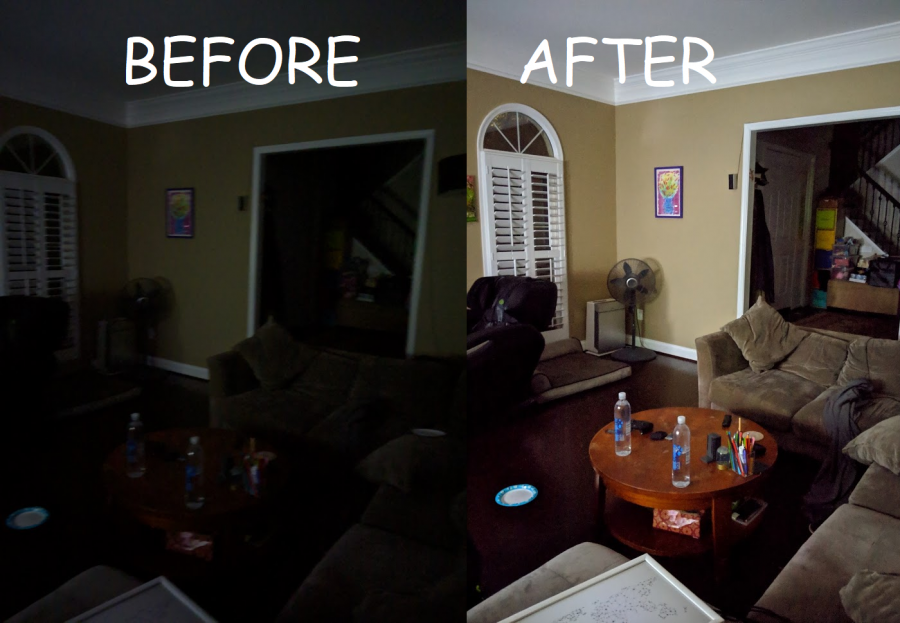
The image size is (900, 623). What are the coordinates of `table` in the screenshot? It's located at (643, 473), (157, 460).